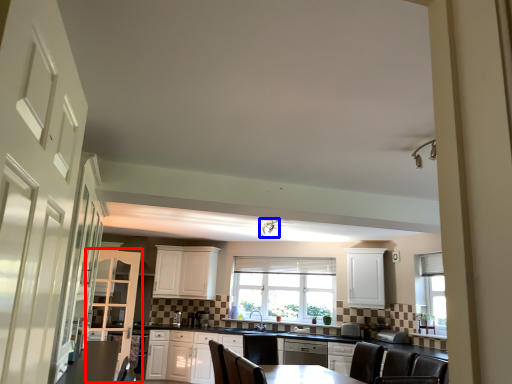
Question: Which of the following is the farthest to the observer, cabinetry (highlighted by a red box) or light fixture (highlighted by a blue box)?

Choices:
 (A) cabinetry
 (B) light fixture

Answer: (A)